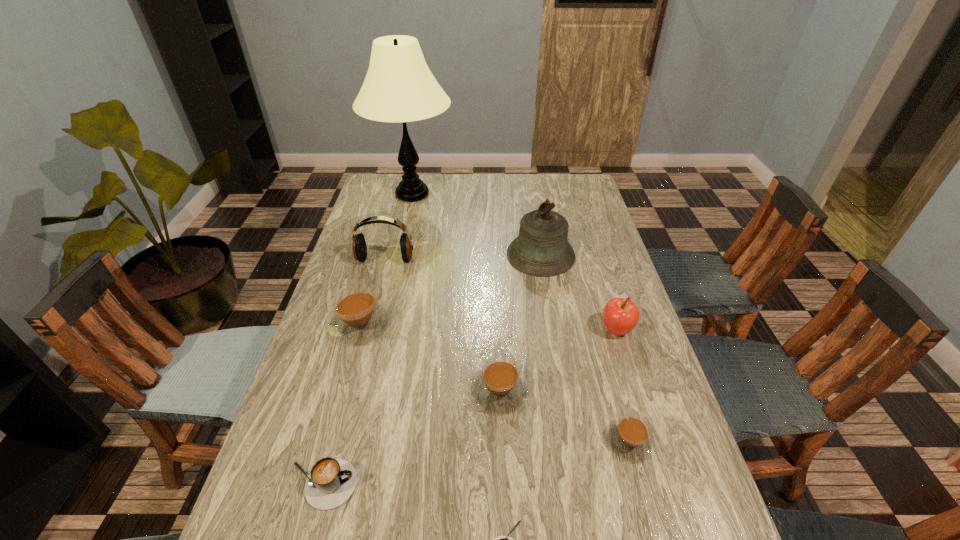
You are a GUI agent. You are given a task and a screenshot of the screen. Output one action in this format:
    pyautogui.click(x=<x>, y=<y>)
    Task: Click on the bigger black cappuccino
    
    Given the screenshot: What is the action you would take?
    pyautogui.click(x=331, y=482)

This screenshot has width=960, height=540. Find the location of `the farther black cappuccino`. the farther black cappuccino is located at coordinates (331, 482).

Find the location of a particular element. The height and width of the screenshot is (540, 960). the rightmost brown cappuccino is located at coordinates (629, 437).

The height and width of the screenshot is (540, 960). Identify the location of the nearest brown cappuccino. (629, 437).

Find the location of a particular element. This screenshot has width=960, height=540. free spot located 0.330m on the right of the black lamp is located at coordinates (536, 194).

Find the location of a particular element. vacant space located on the right of the second tallest object is located at coordinates (589, 255).

Identify the location of free location located on the ear cups of the third tallest object. Image resolution: width=960 pixels, height=540 pixels. (365, 336).

This screenshot has height=540, width=960. I want to click on free region located 0.070m on the left of the apple, so click(x=574, y=330).

The image size is (960, 540). Find the location of `free space located on the right of the farthest cappuccino`. free space located on the right of the farthest cappuccino is located at coordinates 414,324.

Where is `vacant area situated on the left of the second farthest cappuccino`? vacant area situated on the left of the second farthest cappuccino is located at coordinates (430, 390).